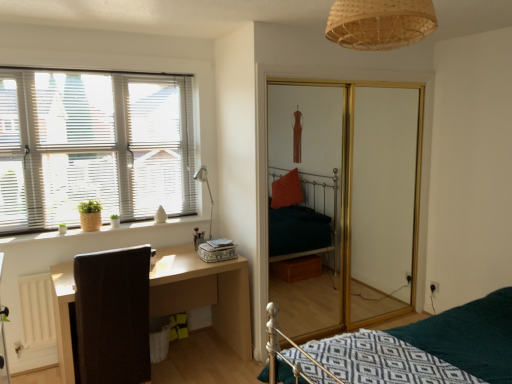
Measure the distance between point (x=194, y=176) and camera.

The distance of point (x=194, y=176) from camera is 3.42 meters.

The width and height of the screenshot is (512, 384). What do you see at coordinates (94, 146) in the screenshot?
I see `white blinds at left` at bounding box center [94, 146].

Consider the image. What is the approximate width of light wood/dark brown desk at lower left?

light wood/dark brown desk at lower left is 24.89 inches in width.

Locate an element on the screen. This screenshot has height=384, width=512. brown leather swivel chair at left is located at coordinates (112, 317).

Locate an element on the screen. Image resolution: width=512 pixels, height=384 pixels. matte silver table lamp at upper left is located at coordinates point(208,191).

From the image's perspective, is matte silver table lamp at upper left over white blinds at left?

No, from the image's perspective, matte silver table lamp at upper left is not above white blinds at left.

Is matte silver table lamp at upper left oriented towards white blinds at left?

No.

Between matte silver table lamp at upper left and white blinds at left, which one has more height?

With more height is white blinds at left.

From a real-world perspective, which is physically above, matte silver table lamp at upper left or gold-framed glass screen door at center?

matte silver table lamp at upper left.

Is matte silver table lamp at upper left oriented towards gold-framed glass screen door at center?

No.

Is point (209, 231) closer or farther from the camera than point (323, 122)?

Clearly, point (209, 231) is closer to the camera than point (323, 122).

Can you confirm if matte silver table lamp at upper left is positioned to the left of gold-framed glass screen door at center?

Yes.

Is white blinds at left bigger than brown leather swivel chair at left?

Actually, white blinds at left might be smaller than brown leather swivel chair at left.

Can you confirm if white blinds at left is taller than brown leather swivel chair at left?

Correct, white blinds at left is much taller as brown leather swivel chair at left.

Can we say white blinds at left lies outside brown leather swivel chair at left?

Indeed, white blinds at left is completely outside brown leather swivel chair at left.

Is brown leather swivel chair at left at the back of wooden window sill at left?

No.

From the image's perspective, which one is positioned lower, wooden window sill at left or brown leather swivel chair at left?

brown leather swivel chair at left.

Is wooden window sill at left shorter than brown leather swivel chair at left?

Correct, wooden window sill at left is not as tall as brown leather swivel chair at left.

Can you tell me how much wooden window sill at left and brown leather swivel chair at left differ in facing direction?

The angle between the facing direction of wooden window sill at left and the facing direction of brown leather swivel chair at left is 179 degrees.

Which is closer to the camera, (331, 28) or (176, 221)?

Point (331, 28) is positioned closer to the camera compared to point (176, 221).

From a real-world perspective, who is located higher, woven bamboo light fixture at upper center or wooden window sill at left?

woven bamboo light fixture at upper center is physically above.

From the image's perspective, which is above, woven bamboo light fixture at upper center or wooden window sill at left?

woven bamboo light fixture at upper center.

Can light wood/dark brown desk at lower left be found inside wooden window sill at left?

No, wooden window sill at left does not contain light wood/dark brown desk at lower left.

From a real-world perspective, who is located higher, wooden window sill at left or light wood/dark brown desk at lower left?

From a 3D spatial view, wooden window sill at left is above.

Between wooden window sill at left and light wood/dark brown desk at lower left, which one has smaller width?

Thinner between the two is wooden window sill at left.

From their relative heights in the image, would you say wooden window sill at left is taller or shorter than light wood/dark brown desk at lower left?

Considering their sizes, wooden window sill at left has less height than light wood/dark brown desk at lower left.

From a real-world perspective, relative to gold-framed glass screen door at center, is white blinds at left vertically above or below?

Clearly, from a real-world perspective, white blinds at left is above gold-framed glass screen door at center.

Between white blinds at left and gold-framed glass screen door at center, which one appears on the left side from the viewer's perspective?

Positioned to the left is white blinds at left.

In the image, there is a white blinds at left. Identify the location of screen door below it (from a real-world perspective). (345, 201).

How distant is white blinds at left from gold-framed glass screen door at center?

1.64 meters.

I want to click on table lamp that appears on the right of white blinds at left, so click(208, 191).

Locate an element on the screen. table lamp on the left of gold-framed glass screen door at center is located at coordinates (208, 191).

When comparing their distances from wooden window sill at left, does brown leather swivel chair at left or white blinds at left seem closer?

white blinds at left lies closer to wooden window sill at left than the other object.

Looking at the image, which one is located further to woven bamboo light fixture at upper center, light wood/dark brown desk at lower left or white blinds at left?

Based on the image, white blinds at left appears to be further to woven bamboo light fixture at upper center.

Looking at the image, which one is located further to white blinds at left, woven bamboo light fixture at upper center or gold-framed glass screen door at center?

woven bamboo light fixture at upper center is further to white blinds at left.

Which object lies further to the anchor point wooden window sill at left, white blinds at left or gold-framed glass screen door at center?

The object further to wooden window sill at left is gold-framed glass screen door at center.

Considering their positions, is gold-framed glass screen door at center positioned closer to wooden window sill at left than light wood/dark brown desk at lower left?

Based on the image, light wood/dark brown desk at lower left appears to be nearer to wooden window sill at left.

Which object lies nearer to the anchor point light wood/dark brown desk at lower left, gold-framed glass screen door at center or brown leather swivel chair at left?

brown leather swivel chair at left is positioned closer to the anchor light wood/dark brown desk at lower left.

Which object lies nearer to the anchor point brown leather swivel chair at left, white blinds at left or woven bamboo light fixture at upper center?

The object closer to brown leather swivel chair at left is white blinds at left.

When comparing their distances from white blinds at left, does brown leather swivel chair at left or gold-framed glass screen door at center seem further?

The object further to white blinds at left is gold-framed glass screen door at center.

The width and height of the screenshot is (512, 384). Identify the location of table between wooden window sill at left and woven bamboo light fixture at upper center. (204, 292).

You are a GUI agent. You are given a task and a screenshot of the screen. Output one action in this format:
    pyautogui.click(x=<x>, y=<y>)
    Task: Click on the swivel chair between woven bamboo light fixture at upper center and matte silver table lamp at upper left in the front-back direction
    
    Given the screenshot: What is the action you would take?
    pyautogui.click(x=112, y=317)

Locate an element on the screen. This screenshot has height=384, width=512. table situated between wooden window sill at left and gold-framed glass screen door at center from left to right is located at coordinates (204, 292).

I want to click on screen door located between woven bamboo light fixture at upper center and matte silver table lamp at upper left in the depth direction, so (x=345, y=201).